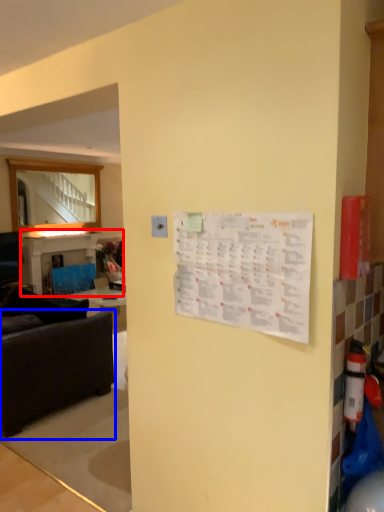
Question: Which object appears farthest to the camera in this image, table (highlighted by a red box) or studio couch (highlighted by a blue box)?

Choices:
 (A) table
 (B) studio couch

Answer: (A)